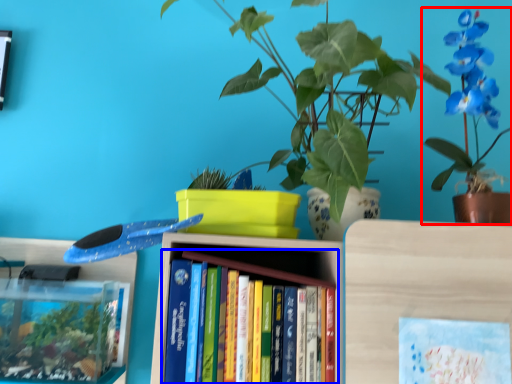
Question: Which object is further to the camera taking this photo, houseplant (highlighted by a red box) or book (highlighted by a blue box)?

Choices:
 (A) houseplant
 (B) book

Answer: (A)